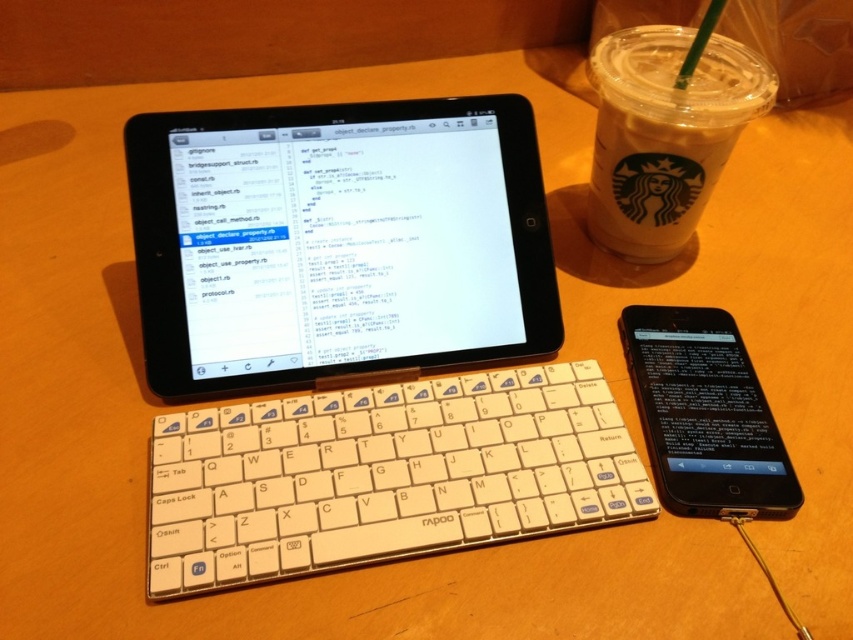
You are a programmer working on the tablet and need to reach for your black glossy phone at center to check a message. Is the white plastic keyboard at center in the way of your hand reaching the phone?

The white plastic keyboard at center is below the black glossy phone at center, so it is positioned lower and would not block your hand from reaching the phone.